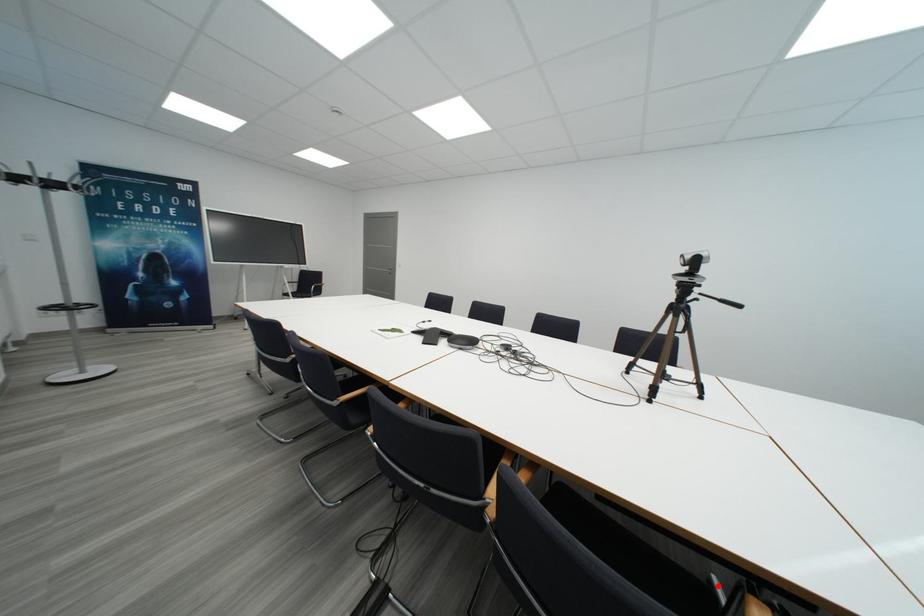
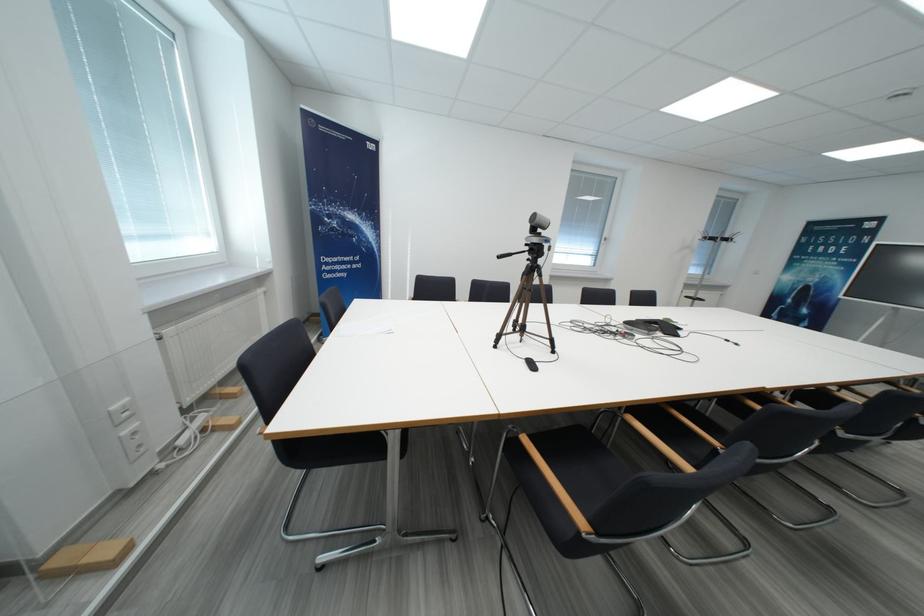
Question: I am providing you with two images of the same scene from different viewpoints. A red point is marked on the first image. Can you still see the location of the red point in image 2?

Choices:
 (A) Yes
 (B) No

Answer: (B)